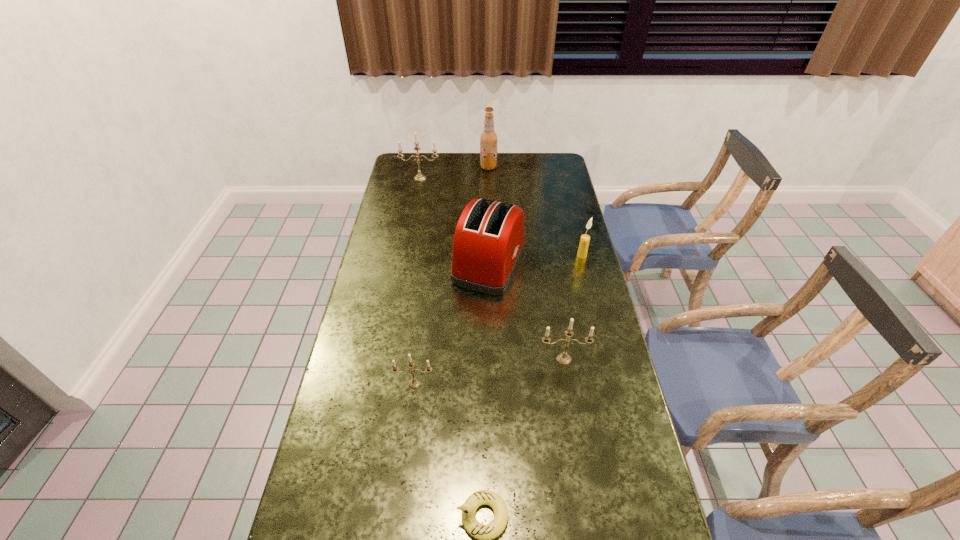
This screenshot has width=960, height=540. In order to click on the tallest object in this screenshot , I will do `click(488, 139)`.

The height and width of the screenshot is (540, 960). What are the coordinates of `beer bottle` in the screenshot? It's located at (488, 139).

Locate an element on the screen. The height and width of the screenshot is (540, 960). toaster is located at coordinates (488, 243).

I want to click on the farthest candle, so click(x=419, y=177).

You are a GUI agent. You are given a task and a screenshot of the screen. Output one action in this format:
    pyautogui.click(x=<x>, y=<y>)
    Task: Click on the second farthest object
    This screenshot has width=960, height=540.
    Given the screenshot: What is the action you would take?
    pyautogui.click(x=419, y=177)

Find the location of a particular element. the rightmost candle is located at coordinates (585, 239).

Find the location of `cream candle`. cream candle is located at coordinates (585, 239).

Locate an element on the screen. The height and width of the screenshot is (540, 960). the rightmost metallic candle is located at coordinates (563, 358).

This screenshot has height=540, width=960. I want to click on the second smallest metallic candle, so click(563, 358).

Image resolution: width=960 pixels, height=540 pixels. In order to click on the nearest candle in this screenshot , I will do `click(414, 382)`.